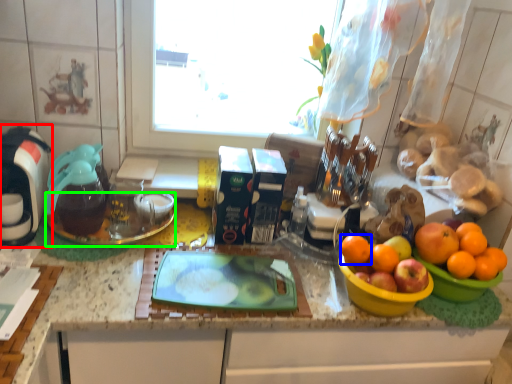
Question: Which is farther away from coffee machine (highlighted by a red box)? orange (highlighted by a blue box) or glass plate (highlighted by a green box)?

Choices:
 (A) orange
 (B) glass plate

Answer: (A)